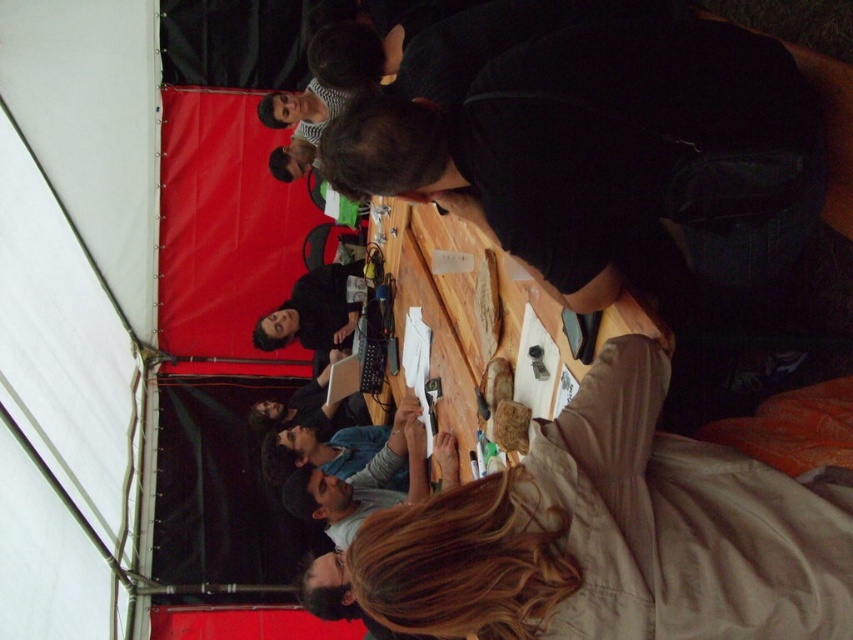
Looking at this image, you are organizing a workshop and need to place a new object on the table. The wooden board at center and the matte black laptop at center are already there. Which object should you place the new object on top of to ensure it is visible to everyone around the table?

The wooden board at center is taller than the matte black laptop at center, so placing the new object on top of the wooden board at center would ensure better visibility for everyone around the table.

You are standing in front of the table in the tent. There are two points marked on the table surface. The first point is at coordinates point (612,166) and the second point is at point (328,410). Which point is closer to you?

Point (612,166) is closer to the viewer than point (328,410).

You are standing in front of the table and want to pick up the matte black laptop at center. Is the black matte shirt at center blocking your access to the laptop?

The black matte shirt at center is closer to the viewer than the matte black laptop at center, so it is blocking access to the laptop.